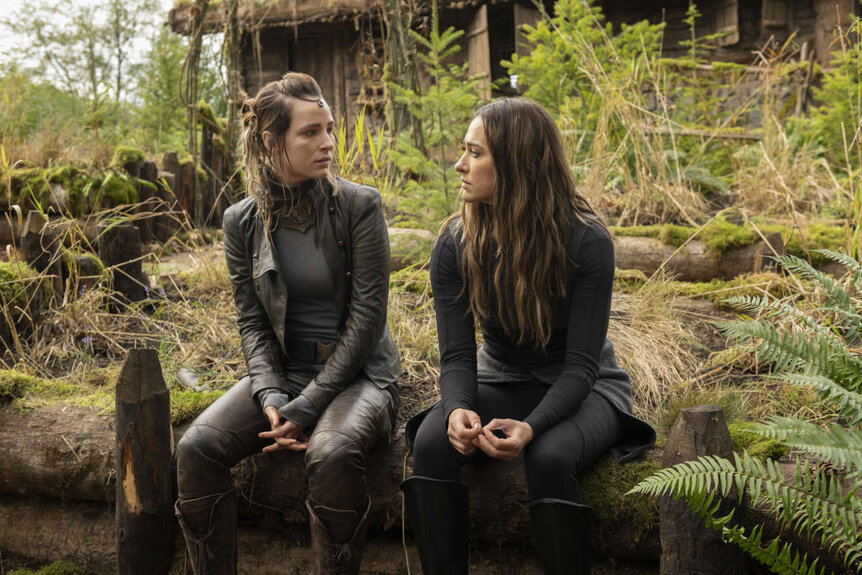
Identify the location of blinde. This screenshot has width=862, height=575. (250, 145).